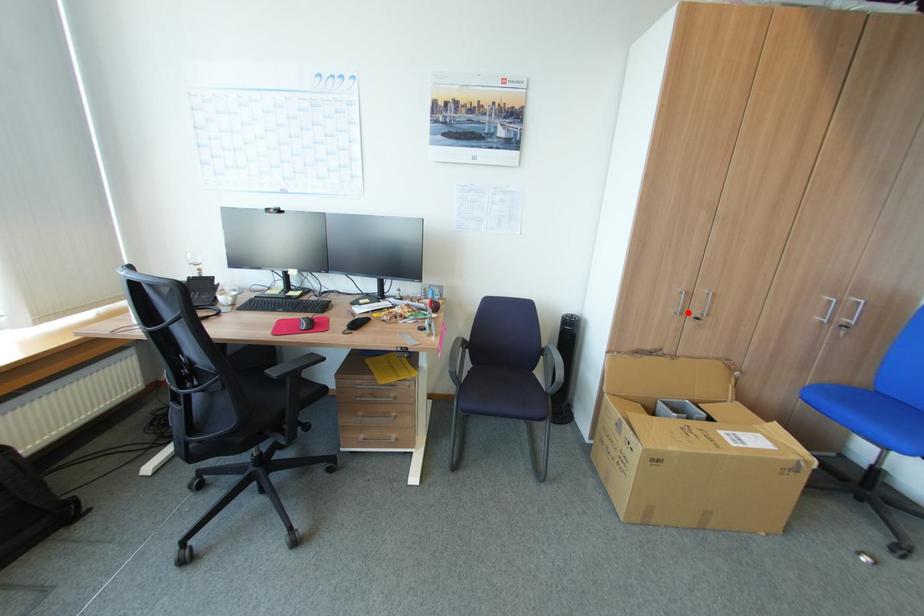
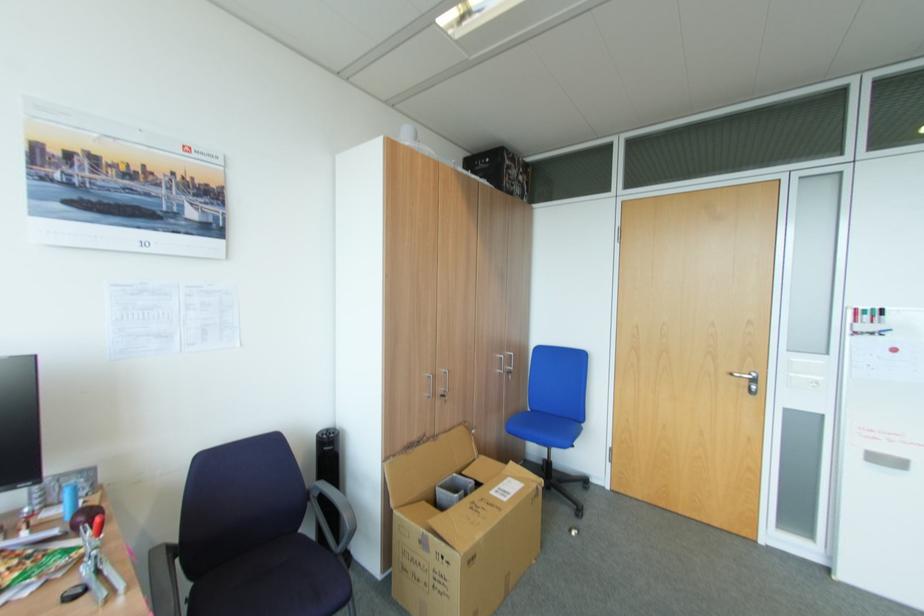
The point at the highlighted location is marked in the first image. Where is the corresponding point in the second image?

(440, 394)